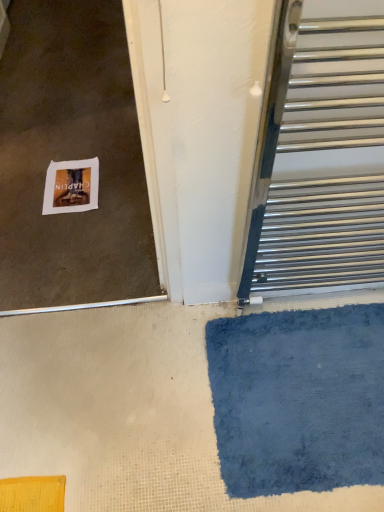
Question: Does white paper at lower left have a smaller size compared to blue plush bath mat at lower right?

Choices:
 (A) no
 (B) yes

Answer: (B)

Question: Does white paper at lower left have a greater height compared to blue plush bath mat at lower right?

Choices:
 (A) yes
 (B) no

Answer: (B)

Question: Considering the relative positions of white paper at lower left and blue plush bath mat at lower right in the image provided, is white paper at lower left to the left of blue plush bath mat at lower right from the viewer's perspective?

Choices:
 (A) yes
 (B) no

Answer: (A)

Question: Considering the relative sizes of white paper at lower left and blue plush bath mat at lower right in the image provided, is white paper at lower left thinner than blue plush bath mat at lower right?

Choices:
 (A) yes
 (B) no

Answer: (A)

Question: From a real-world perspective, is white paper at lower left physically above blue plush bath mat at lower right?

Choices:
 (A) no
 (B) yes

Answer: (A)

Question: Is white paper at lower left shorter than blue plush bath mat at lower right?

Choices:
 (A) yes
 (B) no

Answer: (A)

Question: Considering the relative positions of polished metal towel rack at right and white paper at lower left in the image provided, is polished metal towel rack at right to the right of white paper at lower left from the viewer's perspective?

Choices:
 (A) no
 (B) yes

Answer: (B)

Question: Is polished metal towel rack at right smaller than white paper at lower left?

Choices:
 (A) yes
 (B) no

Answer: (B)

Question: Is polished metal towel rack at right outside of white paper at lower left?

Choices:
 (A) yes
 (B) no

Answer: (A)

Question: Is polished metal towel rack at right closer to the viewer compared to white paper at lower left?

Choices:
 (A) no
 (B) yes

Answer: (B)

Question: Does polished metal towel rack at right appear on the left side of white paper at lower left?

Choices:
 (A) yes
 (B) no

Answer: (B)

Question: Is polished metal towel rack at right wider than white paper at lower left?

Choices:
 (A) yes
 (B) no

Answer: (B)

Question: Can you confirm if blue plush bath mat at lower right is thinner than polished metal towel rack at right?

Choices:
 (A) yes
 (B) no

Answer: (B)